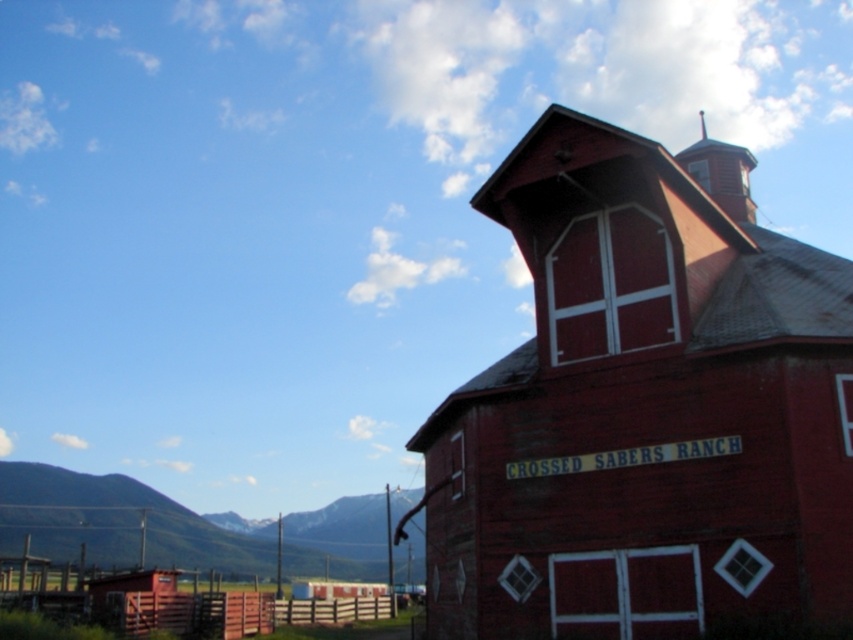
You are standing in front of the barn at CROSSED SABERS RANCH and see two points marked on the image. The first point is at coordinates point (782, 566) and the second point is at point (734, 173). Which point is closer to you?

Point (782, 566) is closer to the viewer than point (734, 173).

You are standing in the middle of the ranch and want to walk towards the green grassy hill at lower left. Which direction should you head to avoid the rustic wood barn tower at upper right?

You should head to the left to avoid the rustic wood barn tower at upper right because the green grassy hill at lower left is located to the left of the rustic wood barn tower at upper right.